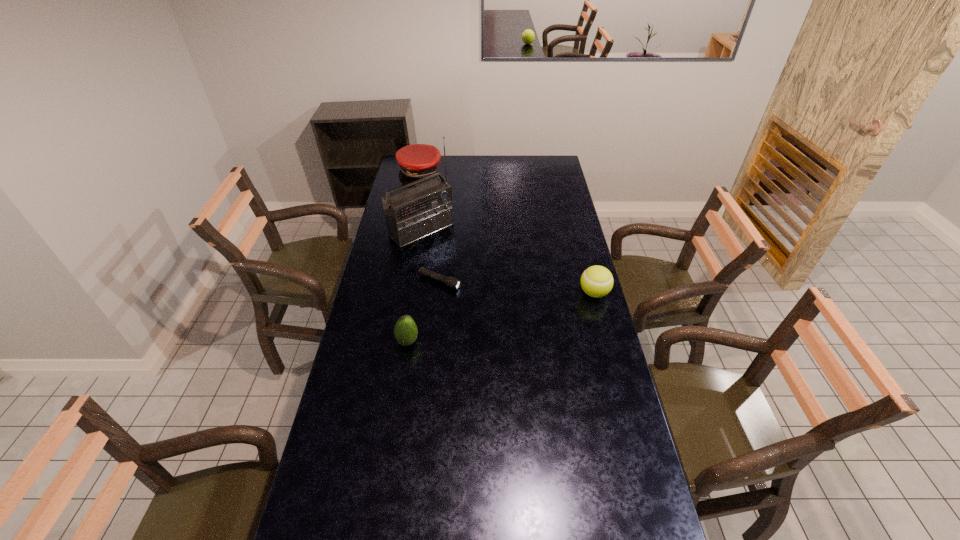
The image size is (960, 540). Find the location of `cap present at the left edge`. cap present at the left edge is located at coordinates (416, 161).

You are a GUI agent. You are given a task and a screenshot of the screen. Output one action in this format:
    pyautogui.click(x=<x>, y=<y>)
    Task: Click on the object at the right edge
    
    Given the screenshot: What is the action you would take?
    pyautogui.click(x=597, y=281)

This screenshot has height=540, width=960. Identify the location of object present at the far left corner. [416, 161].

Locate an element on the screen. This screenshot has height=540, width=960. free space at the far edge is located at coordinates (522, 158).

In the image, there is a desktop. Identify the location of vacant region at the left edge. This screenshot has height=540, width=960. (403, 310).

Where is `vacant space at the right edge of the desktop`? The image size is (960, 540). vacant space at the right edge of the desktop is located at coordinates (568, 292).

Where is `vacant space at the near left corner of the desktop`? This screenshot has height=540, width=960. vacant space at the near left corner of the desktop is located at coordinates (352, 507).

This screenshot has height=540, width=960. Identify the location of blank space at the near right corner. (654, 525).

Image resolution: width=960 pixels, height=540 pixels. In order to click on vacant region between the avocado and the flashlight in this screenshot , I will do (x=423, y=312).

Identify the location of free space between the avocado and the rightmost object. (501, 317).